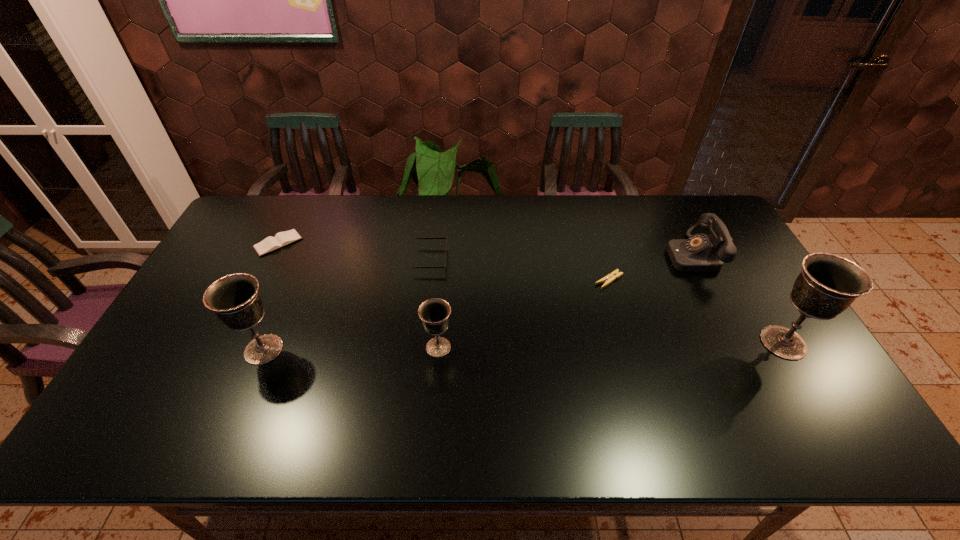
Identify the location of empty space that is in between the sixth shortest object and the rightmost chalice. (523, 346).

The width and height of the screenshot is (960, 540). Identify the location of free space that is in between the diary and the sixth shortest object. (271, 296).

You are a GUI agent. You are given a task and a screenshot of the screen. Output one action in this format:
    pyautogui.click(x=<x>, y=<y>)
    Task: Click on the free space that is in between the rightmost chalice and the sunglasses
    The image size is (960, 540).
    Given the screenshot: What is the action you would take?
    pyautogui.click(x=607, y=301)

Identify the location of vacant region between the sunglasses and the telephone. (561, 257).

Where is `vacant region between the fifth object from left to right and the rightmost chalice`? The height and width of the screenshot is (540, 960). vacant region between the fifth object from left to right and the rightmost chalice is located at coordinates (696, 312).

This screenshot has height=540, width=960. What are the coordinates of `empty space between the shortest chalice and the second shortest chalice` in the screenshot? It's located at (351, 348).

Identify the location of free space between the rightmost chalice and the shortest object. The width and height of the screenshot is (960, 540). (696, 312).

Locate an element on the screen. The image size is (960, 540). unoccupied position between the sixth tallest object and the telephone is located at coordinates (485, 249).

I want to click on free area in between the clothespin and the second chalice from left to right, so click(524, 314).

What are the coordinates of `the third closest object to the second chalice from left to right` in the screenshot? It's located at (609, 278).